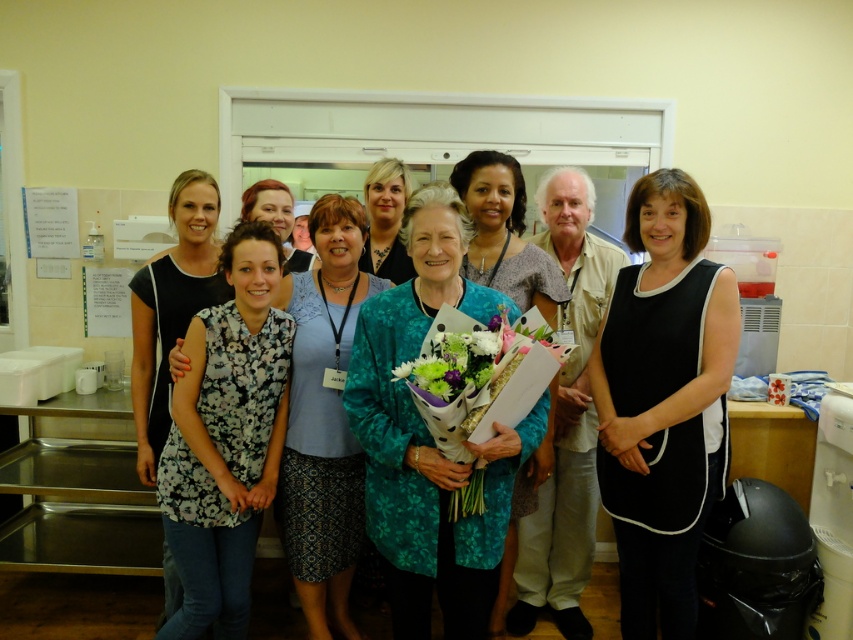
Question: Based on their relative distances, which object is farther from the matte floral dress at center?

Choices:
 (A) khaki cotton shirt at center
 (B) floral fabric blouse at center
 (C) green floral bouquet at center
 (D) teal floral dress at center

Answer: (C)

Question: Among these points, which one is nearest to the camera?

Choices:
 (A) (564, 186)
 (B) (717, 317)
 (C) (161, 410)
 (D) (375, 461)

Answer: (D)

Question: Where is khaki cotton shirt at center located in relation to green floral bouquet at center in the image?

Choices:
 (A) right
 (B) left

Answer: (A)

Question: Which point is closer to the camera?

Choices:
 (A) teal floral dress at center
 (B) green floral bouquet at center

Answer: (B)

Question: Where is matte floral dress at center located in relation to fluffy bouquet at center in the image?

Choices:
 (A) above
 (B) below

Answer: (A)

Question: Is black satin dress at center smaller than matte floral dress at center?

Choices:
 (A) no
 (B) yes

Answer: (A)